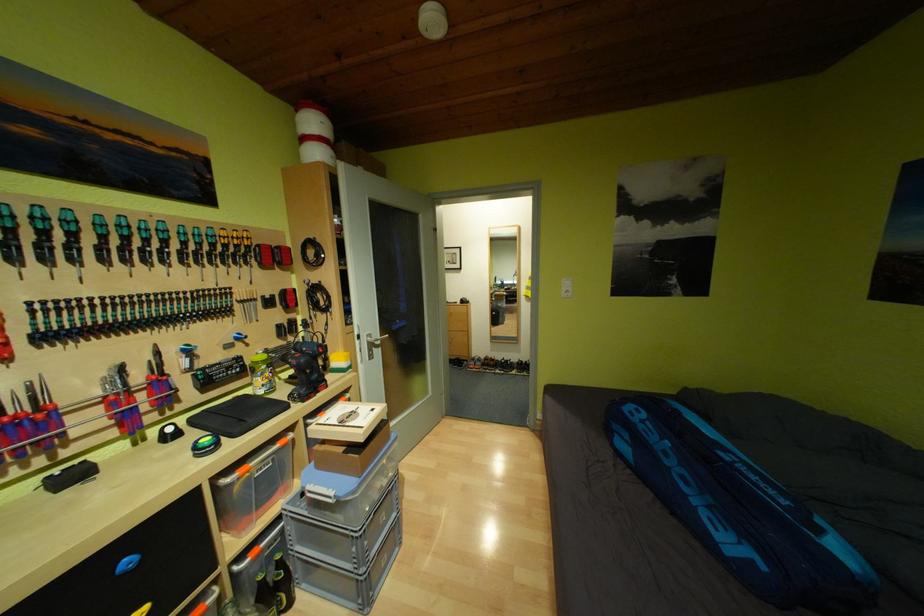
I want to click on light switch, so click(566, 288).